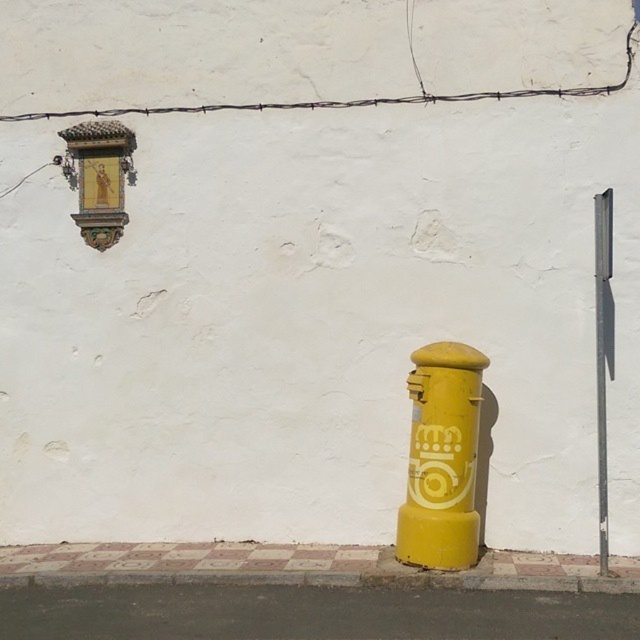
You are standing at the center of the image and want to walk to the smooth asphalt pavement at lower center. According to the coordinates provided, in which direction should you move relative to your current position?

The smooth asphalt pavement at lower center is located at point (x=310, y=612), which means you should move downward and slightly to the right from your current position at the center to reach it.

You are a delivery person trying to park a 1.2 meter wide cart between the yellow concrete curb at lower center and the smooth metallic pole at right. Can you fit your cart there?

The yellow concrete curb at lower center might be wider than the smooth metallic pole at right, so it is uncertain if the 1.2 meter wide cart can fit between them. Check the actual width before attempting to park.